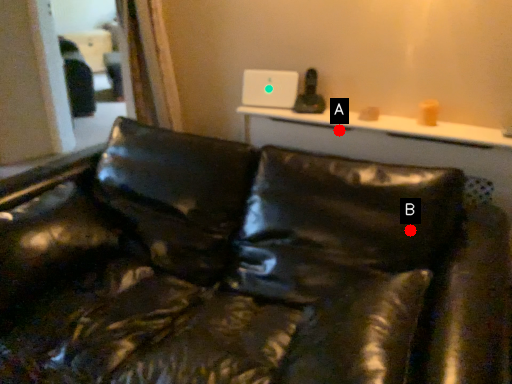
Question: Two points are circled on the image, labeled by A and B beside each circle. Which point is closer to the camera taking this photo?

Choices:
 (A) A is closer
 (B) B is closer

Answer: (B)